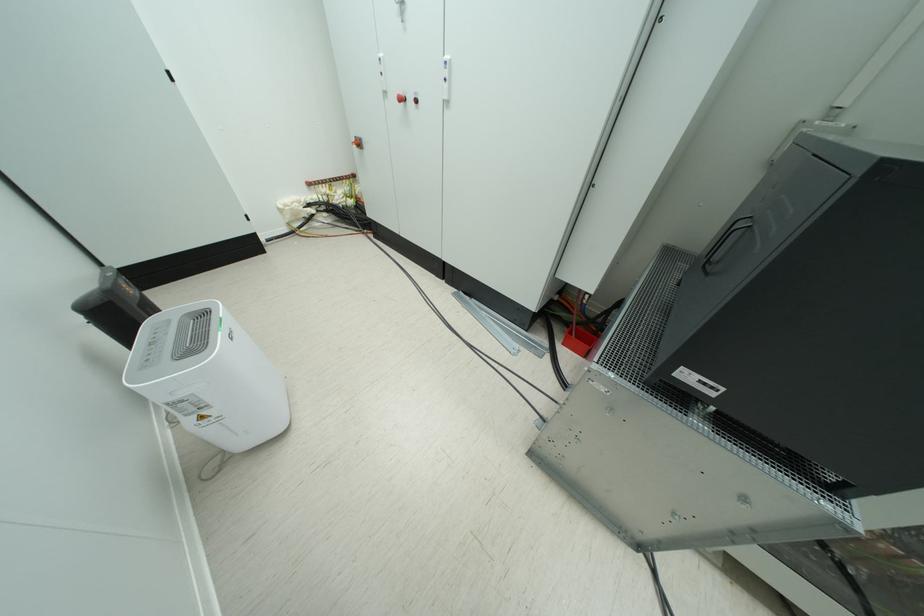
In order to click on cabinet keyhole in this screenshot , I will do `click(673, 10)`.